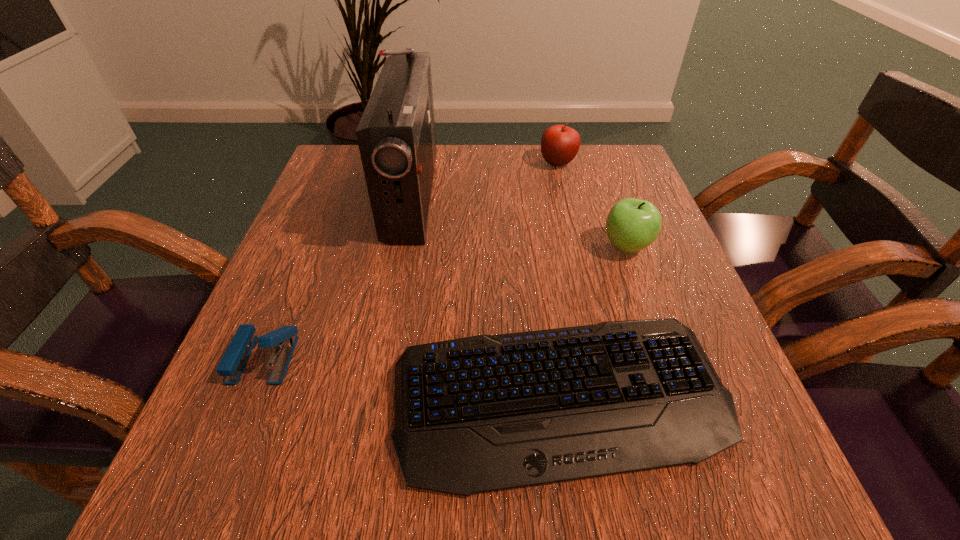
Identify the location of radio receiver. The height and width of the screenshot is (540, 960). point(396,136).

This screenshot has height=540, width=960. I want to click on the nearer apple, so click(632, 224).

At what (x,y) coordinates should I click in order to perform the action: click on the farther apple. Please return your answer as a coordinate pair (x, y). The image size is (960, 540). Looking at the image, I should click on (560, 144).

Locate an element on the screen. The image size is (960, 540). stapler is located at coordinates (235, 358).

The image size is (960, 540). I want to click on the second shortest object, so click(235, 358).

Identify the location of computer keyboard. (483, 413).

Find the location of `vacant region located on the front-facing side of the radio receiver`. vacant region located on the front-facing side of the radio receiver is located at coordinates (612, 195).

At what (x,y) coordinates should I click in order to perform the action: click on blank area located on the front of the nearer apple. Please return your answer as a coordinate pair (x, y). Looking at the image, I should click on click(654, 321).

What are the coordinates of `vacant space located on the front of the farther apple` in the screenshot? It's located at (571, 219).

Locate an element on the screen. The height and width of the screenshot is (540, 960). free location located on the right of the second shortest object is located at coordinates (447, 359).